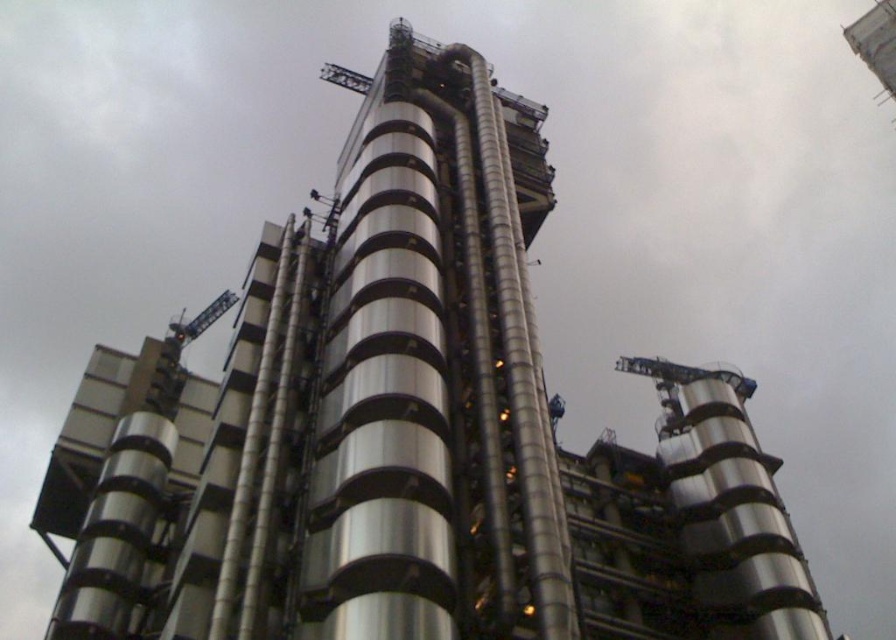
Question: Does metallic silver tower at center appear on the right side of metallic gray crane at upper left?

Choices:
 (A) yes
 (B) no

Answer: (A)

Question: Can you confirm if metallic silver tower at center is thinner than metallic gray crane at upper left?

Choices:
 (A) no
 (B) yes

Answer: (B)

Question: Which point is closer to the camera?

Choices:
 (A) metallic gray crane at upper left
 (B) metallic silver tower at center

Answer: (B)

Question: Which point is closer to the camera?

Choices:
 (A) metallic silver tower at center
 (B) metallic gray crane at upper left

Answer: (A)

Question: Can you confirm if metallic silver tower at center is smaller than metallic gray crane at upper left?

Choices:
 (A) yes
 (B) no

Answer: (B)

Question: Which point is closer to the camera taking this photo?

Choices:
 (A) 342,400
 (B) 208,317

Answer: (A)